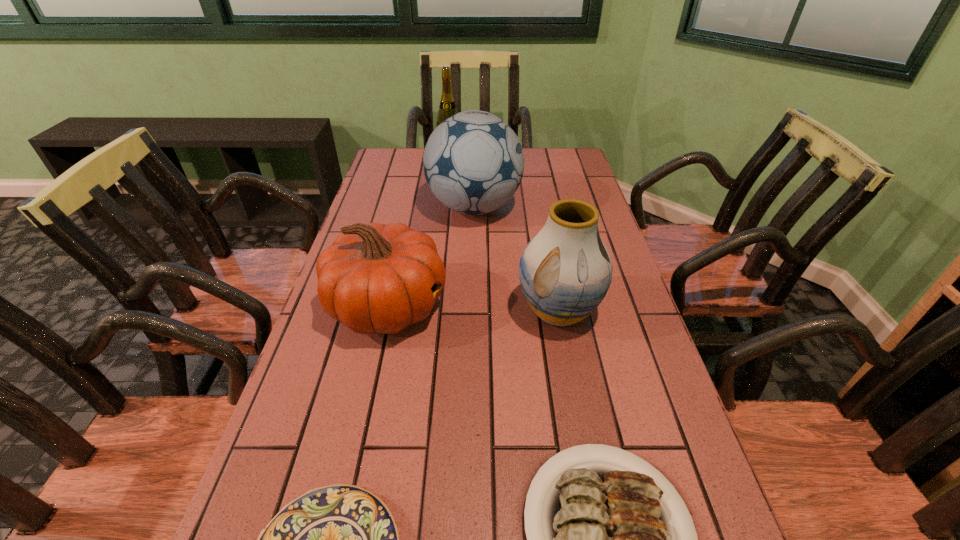
I want to click on the farthest object, so click(x=447, y=108).

Identify the location of the second farthest object. (473, 162).

Locate an element on the screen. The height and width of the screenshot is (540, 960). vase is located at coordinates (565, 271).

Where is `pumpkin`? pumpkin is located at coordinates (375, 278).

Locate an element on the screen. The height and width of the screenshot is (540, 960). free space located 0.380m on the front-facing side of the farthest object is located at coordinates (443, 220).

You are a GUI agent. You are given a task and a screenshot of the screen. Output one action in this format:
    pyautogui.click(x=<x>, y=<y>)
    Task: Click on the free point located on the side with brand of the soccer ball
    
    Given the screenshot: What is the action you would take?
    pyautogui.click(x=554, y=207)

What are the coordinates of `vacant space situated on the front of the vase` in the screenshot? It's located at (594, 503).

This screenshot has width=960, height=540. What are the coordinates of `vacant space located on the face of the fourth tallest object` in the screenshot? It's located at (618, 306).

Find the location of `object located in the far edge section of the desktop`. object located in the far edge section of the desktop is located at coordinates (447, 108).

Find the location of a particular element. This screenshot has height=540, width=960. object situated at the left edge is located at coordinates (375, 278).